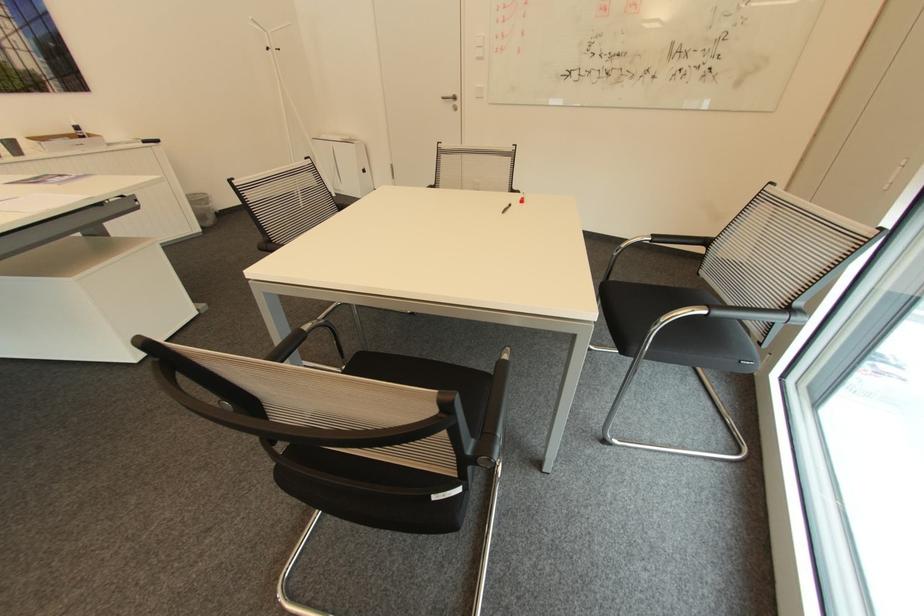
Identify the location of red pen cap. The width and height of the screenshot is (924, 616). (521, 199).